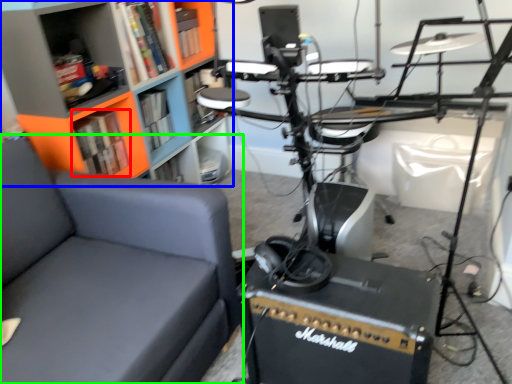
Question: Estimate the real-world distances between objects in this image. Which object is closer to book (highlighted by a red box), bookcase (highlighted by a blue box) or chair (highlighted by a green box)?

Choices:
 (A) bookcase
 (B) chair

Answer: (A)